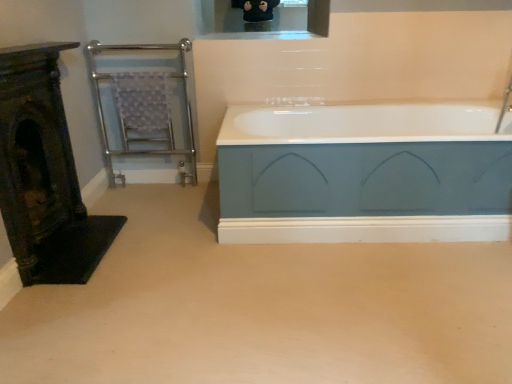
Question: From a real-world perspective, is dark green ornate fireplace at left above or below teal matte bathtub at center?

Choices:
 (A) below
 (B) above

Answer: (B)

Question: Considering the positions of dark green ornate fireplace at left and teal matte bathtub at center in the image, is dark green ornate fireplace at left wider or thinner than teal matte bathtub at center?

Choices:
 (A) thin
 (B) wide

Answer: (A)

Question: Estimate the real-world distances between objects in this image. Which object is farther from the teal matte bathtub at center?

Choices:
 (A) dark green ornate fireplace at left
 (B) chrome/metallic towel rail at left

Answer: (B)

Question: Estimate the real-world distances between objects in this image. Which object is closer to the chrome/metallic towel rail at left?

Choices:
 (A) teal matte bathtub at center
 (B) dark green ornate fireplace at left

Answer: (B)